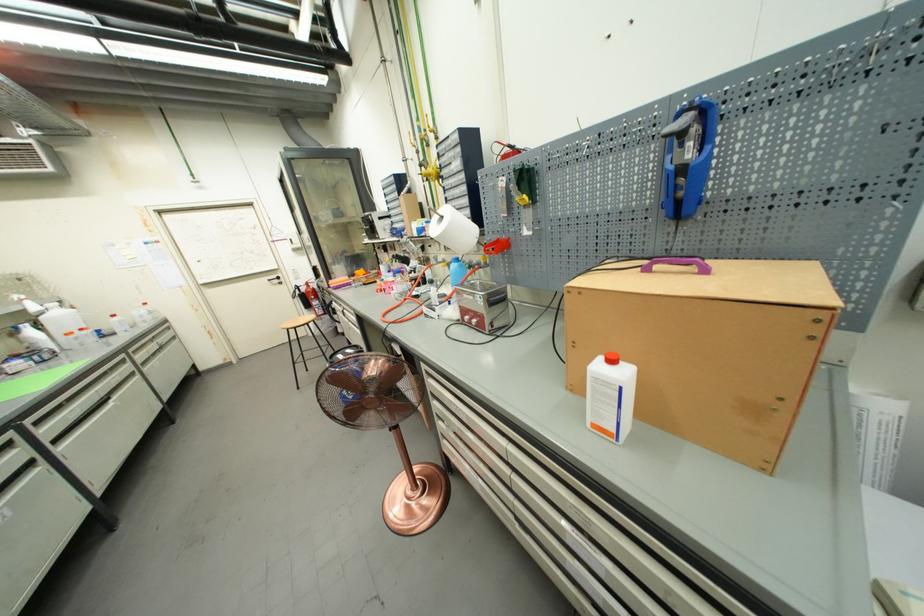
Find the location of a particular element. white door handle is located at coordinates (274, 280).